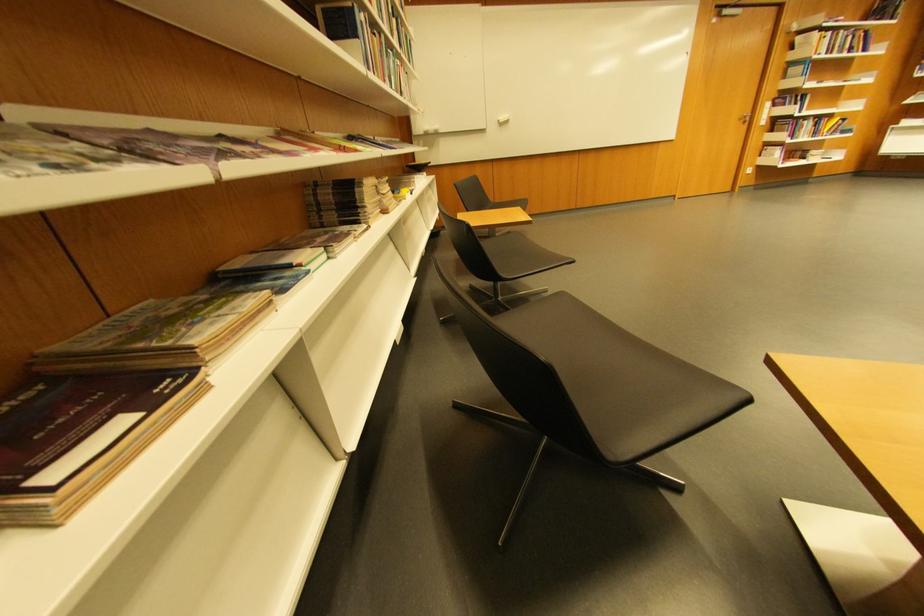
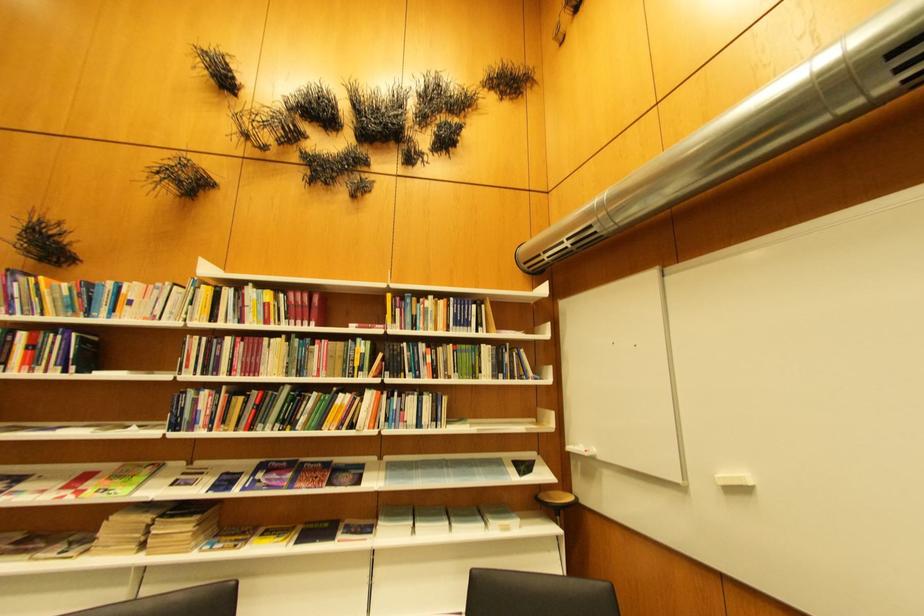
In the second image, find the point that corresponds to pixel 513 120 in the first image.

(738, 479)